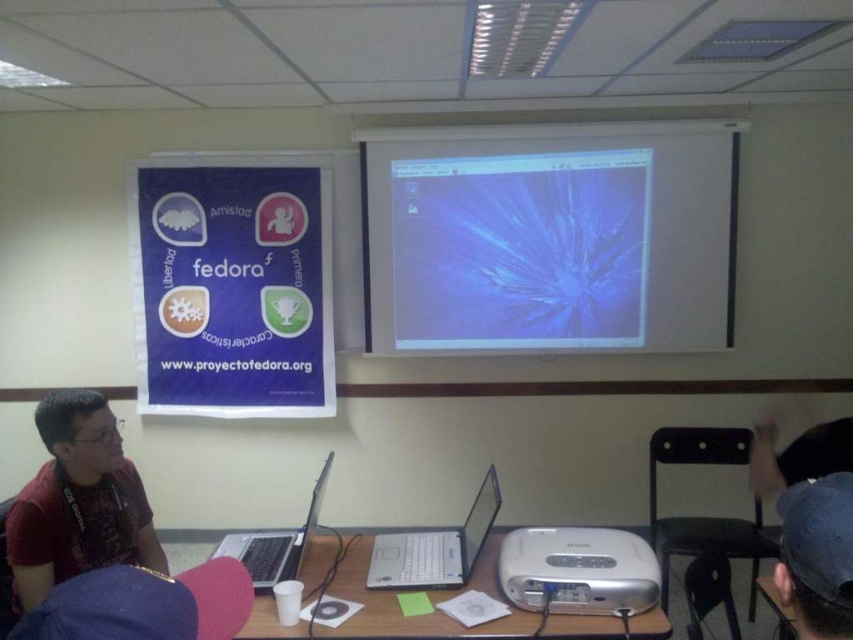
Question: Does silver metallic projector at lower center lie behind black plastic laptop at center?

Choices:
 (A) no
 (B) yes

Answer: (A)

Question: Which of these objects is positioned closest to the white matte projection screen at upper center?

Choices:
 (A) matte paper poster at upper left
 (B) matte red shirt at left
 (C) black fabric cap at upper right

Answer: (A)

Question: Which point appears closest to the camera in this image?

Choices:
 (A) (410, 266)
 (B) (45, 579)

Answer: (B)

Question: Estimate the real-world distances between objects in this image. Which object is closer to the silver metallic laptop at center?

Choices:
 (A) black plastic laptop at center
 (B) white matte projection screen at upper center
 (C) matte paper poster at upper left

Answer: (A)

Question: Can you confirm if silver metallic projector at center is positioned above black plastic laptop at center?

Choices:
 (A) no
 (B) yes

Answer: (A)

Question: Where is matte paper poster at upper left located in relation to black plastic laptop at center in the image?

Choices:
 (A) below
 (B) above

Answer: (B)